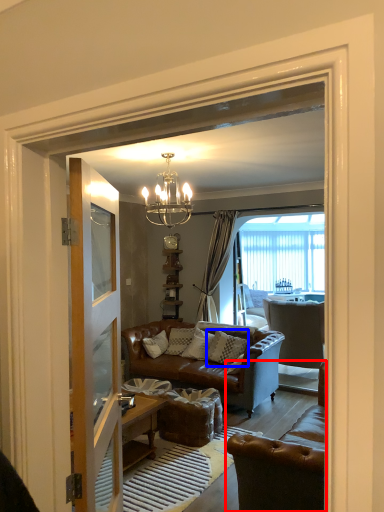
Question: Which object is closer to the camera taking this photo, chair (highlighted by a red box) or pillow (highlighted by a blue box)?

Choices:
 (A) chair
 (B) pillow

Answer: (A)